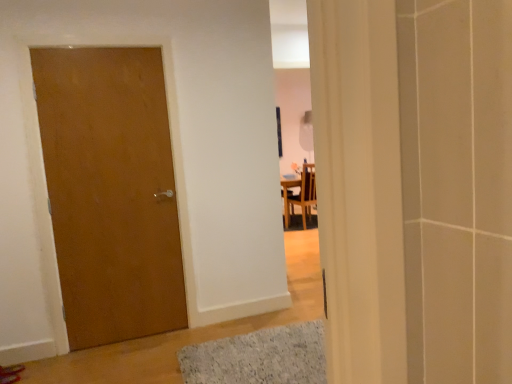
Question: Are gray textured bath mat at lower center and matte wood door at left far apart?

Choices:
 (A) no
 (B) yes

Answer: (B)

Question: Does gray textured bath mat at lower center appear on the right side of matte wood door at left?

Choices:
 (A) no
 (B) yes

Answer: (B)

Question: Considering the relative sizes of gray textured bath mat at lower center and matte wood door at left in the image provided, is gray textured bath mat at lower center taller than matte wood door at left?

Choices:
 (A) no
 (B) yes

Answer: (A)

Question: Is gray textured bath mat at lower center oriented away from matte wood door at left?

Choices:
 (A) yes
 (B) no

Answer: (B)

Question: Is the position of gray textured bath mat at lower center more distant than that of matte wood door at left?

Choices:
 (A) yes
 (B) no

Answer: (B)

Question: Visually, is gray textured bath mat at lower center positioned to the left or to the right of matte wood door at left?

Choices:
 (A) left
 (B) right

Answer: (B)

Question: Is gray textured bath mat at lower center taller or shorter than matte wood door at left?

Choices:
 (A) tall
 (B) short

Answer: (B)

Question: From the image's perspective, is gray textured bath mat at lower center positioned above or below matte wood door at left?

Choices:
 (A) below
 (B) above

Answer: (A)

Question: Relative to matte wood door at left, is gray textured bath mat at lower center in front or behind?

Choices:
 (A) front
 (B) behind

Answer: (A)

Question: Would you say wooden chair at center is inside or outside gray textured bath mat at lower center?

Choices:
 (A) inside
 (B) outside

Answer: (B)

Question: Relative to gray textured bath mat at lower center, is wooden chair at center in front or behind?

Choices:
 (A) behind
 (B) front

Answer: (A)

Question: From the image's perspective, is wooden chair at center located above or below gray textured bath mat at lower center?

Choices:
 (A) below
 (B) above

Answer: (B)

Question: In terms of height, does wooden chair at center look taller or shorter compared to gray textured bath mat at lower center?

Choices:
 (A) tall
 (B) short

Answer: (A)

Question: Is point click(x=109, y=281) positioned closer to the camera than point click(x=296, y=382)?

Choices:
 (A) farther
 (B) closer

Answer: (A)

Question: Is matte wood door at left wider or thinner than gray textured bath mat at lower center?

Choices:
 (A) thin
 (B) wide

Answer: (A)